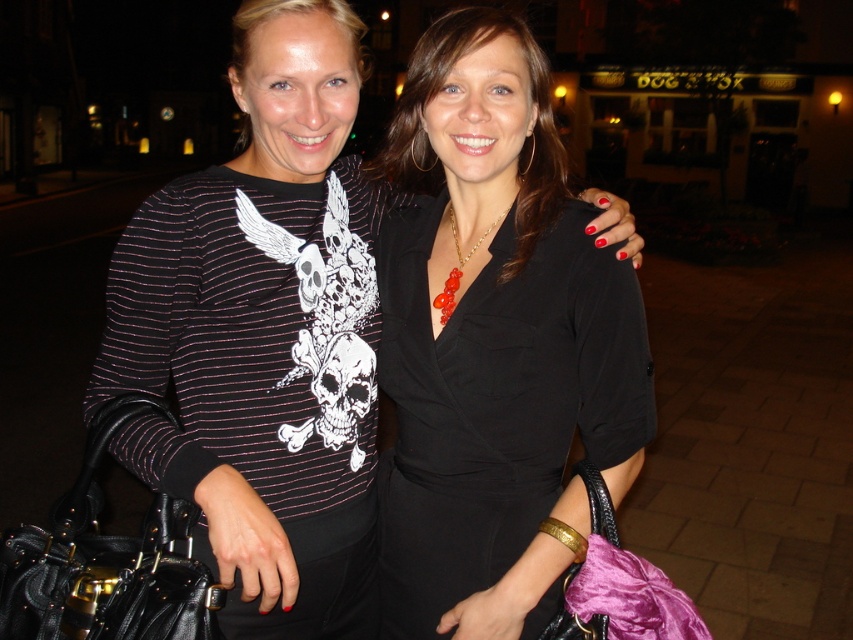
Question: Where is striped jersey shirt at left located in relation to black leather handbag at left in the image?

Choices:
 (A) below
 (B) above

Answer: (B)

Question: Is black satin dress at center smaller than velvet purple bag at lower right?

Choices:
 (A) yes
 (B) no

Answer: (B)

Question: Which point appears farthest from the camera in this image?

Choices:
 (A) (579, 561)
 (B) (596, 298)
 (C) (120, 253)
 (D) (195, 451)

Answer: (B)

Question: Can you confirm if striped jersey shirt at left is smaller than black leather handbag at left?

Choices:
 (A) no
 (B) yes

Answer: (A)

Question: Which object is the farthest from the striped jersey shirt at left?

Choices:
 (A) velvet purple bag at lower right
 (B) matte black dress at center
 (C) black satin dress at center

Answer: (A)

Question: Which of the following is the closest to the observer?

Choices:
 (A) black satin dress at center
 (B) black leather handbag at left
 (C) striped jersey shirt at left

Answer: (B)